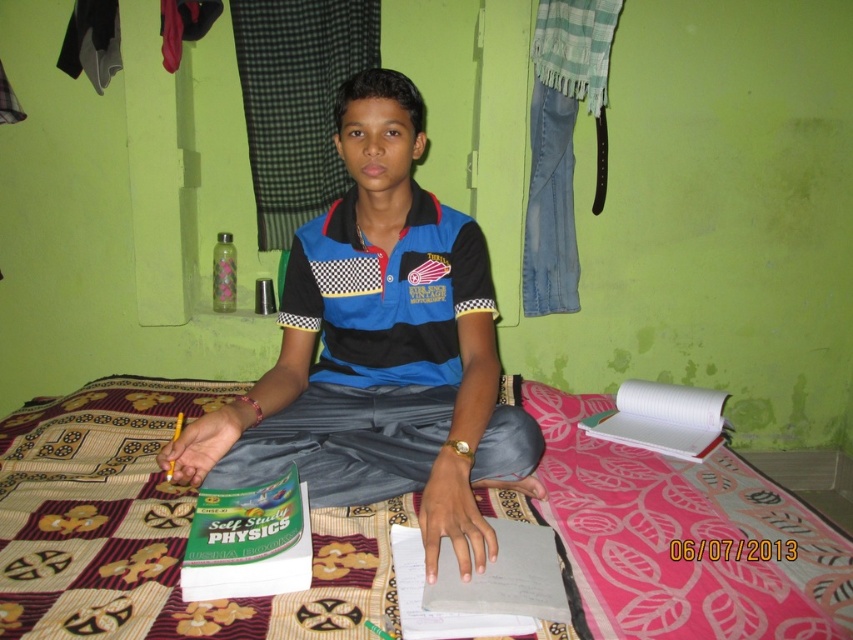
You are a tailor who needs to determine which item is more suitable for covering a large surface area. Based on the scene, which item would you choose between the patterned fabric bed at center and the blue cotton shirt at center?

The patterned fabric bed at center has a larger size compared to the blue cotton shirt at center, so it would be more suitable for covering a large surface area.